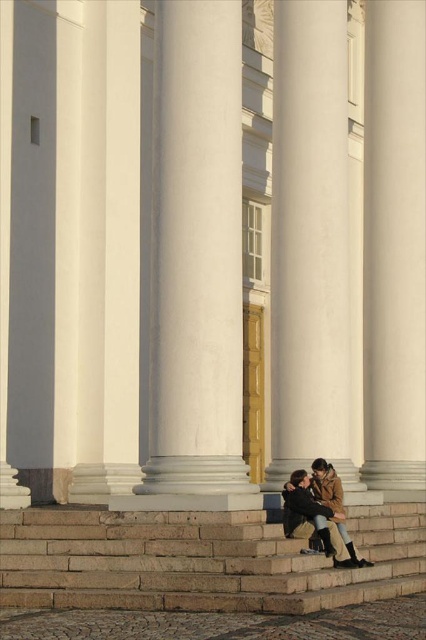
Question: Estimate the real-world distances between objects in this image. Which object is farther from the brown leather jacket at lower center?

Choices:
 (A) white smooth column at center
 (B) white marble column at center
 (C) stone stairs at center

Answer: (A)

Question: Is white marble column at center closer to camera compared to brown leather jacket at lower center?

Choices:
 (A) yes
 (B) no

Answer: (A)

Question: Can you confirm if stone stairs at center is bigger than white smooth column at center?

Choices:
 (A) no
 (B) yes

Answer: (B)

Question: Does white marble column at center have a smaller size compared to brown leather jacket at lower center?

Choices:
 (A) no
 (B) yes

Answer: (A)

Question: Which of the following is the farthest from the observer?

Choices:
 (A) white smooth column at center
 (B) brown leather jacket at lower center
 (C) white marble column at center

Answer: (A)

Question: Which point appears closest to the camera in this image?

Choices:
 (A) (316, 522)
 (B) (25, 528)

Answer: (A)